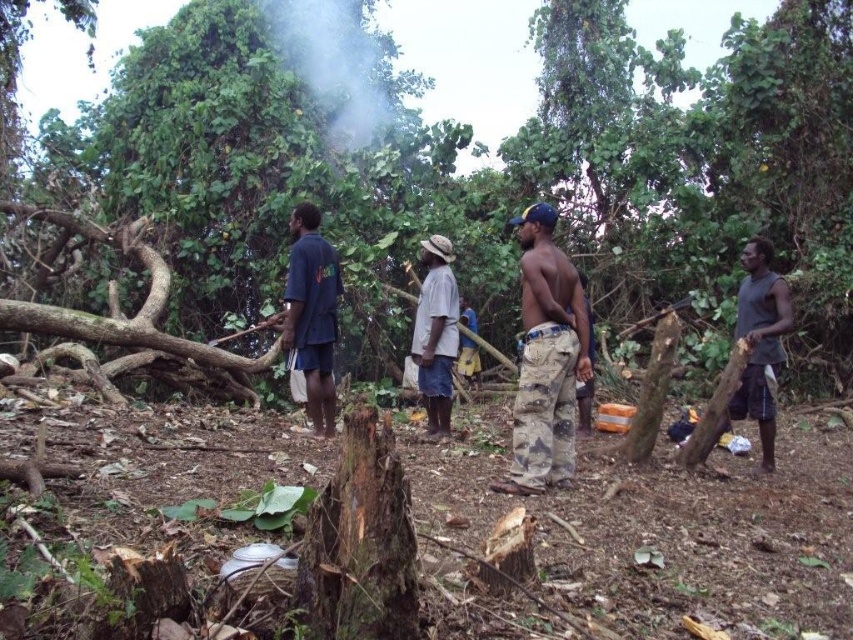
What do you see at coordinates (544, 358) in the screenshot?
I see `camouflage pants at center` at bounding box center [544, 358].

Does camouflage pants at center appear on the right side of dark blue shirt at center?

Yes, camouflage pants at center is to the right of dark blue shirt at center.

The height and width of the screenshot is (640, 853). What do you see at coordinates (544, 358) in the screenshot?
I see `camouflage pants at center` at bounding box center [544, 358].

The height and width of the screenshot is (640, 853). In order to click on camouflage pants at center in this screenshot , I will do `click(544, 358)`.

Consider the image. Measure the distance between camouflage pants at center and gray sleeveless shirt at right.

camouflage pants at center is 1.73 meters from gray sleeveless shirt at right.

Is point (538, 275) more distant than point (764, 280)?

No.

Identify the location of camouflage pants at center. (544, 358).

Where is `brown rough tree stump at center`? Image resolution: width=853 pixels, height=640 pixels. brown rough tree stump at center is located at coordinates (479, 170).

Where is `brown rough tree stump at center`? This screenshot has height=640, width=853. brown rough tree stump at center is located at coordinates (479, 170).

Where is `brown rough tree stump at center`? brown rough tree stump at center is located at coordinates (479, 170).